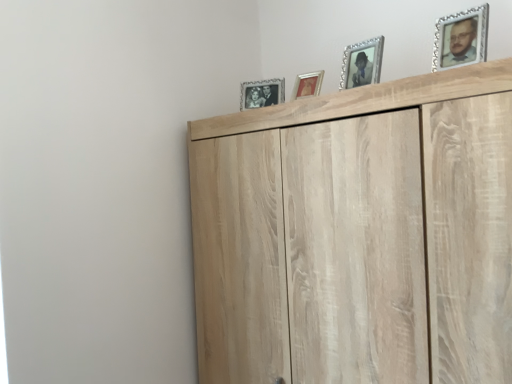
Question: Would you say gold-framed picture at upper center, which ranks as the 3th picture frame in front-to-back order, contains light wood cupboard at upper center?

Choices:
 (A) no
 (B) yes

Answer: (A)

Question: Does gold-framed picture at upper center, placed as the 3th picture frame when sorted from right to left, have a greater width compared to light wood cupboard at upper center?

Choices:
 (A) yes
 (B) no

Answer: (B)

Question: From the image's perspective, does gold-framed picture at upper center, acting as the 2th picture frame starting from the back, appear higher than light wood cupboard at upper center?

Choices:
 (A) no
 (B) yes

Answer: (B)

Question: Can you confirm if gold-framed picture at upper center, placed as the 3th picture frame when sorted from right to left, is bigger than light wood cupboard at upper center?

Choices:
 (A) no
 (B) yes

Answer: (A)

Question: From a real-world perspective, is gold-framed picture at upper center, placed as the 3th picture frame when sorted from right to left, located beneath light wood cupboard at upper center?

Choices:
 (A) no
 (B) yes

Answer: (A)

Question: Is light wood cupboard at upper center at the back of gold-framed picture at upper center, the 2th picture frame positioned from the left?

Choices:
 (A) no
 (B) yes

Answer: (A)

Question: From a real-world perspective, does silver/glass photo frame at upper center, which is the fourth picture frame in front-to-back order, stand above light wood cupboard at upper center?

Choices:
 (A) yes
 (B) no

Answer: (A)

Question: Would you say silver/glass photo frame at upper center, which is the fourth picture frame in front-to-back order, is outside light wood cupboard at upper center?

Choices:
 (A) yes
 (B) no

Answer: (A)

Question: From the image's perspective, would you say silver/glass photo frame at upper center, placed as the 1th picture frame when sorted from back to front, is positioned over light wood cupboard at upper center?

Choices:
 (A) no
 (B) yes

Answer: (B)

Question: Is silver/glass photo frame at upper center, which appears as the first picture frame when viewed from the left, oriented towards light wood cupboard at upper center?

Choices:
 (A) no
 (B) yes

Answer: (A)

Question: From a real-world perspective, is silver/glass photo frame at upper center, which appears as the fourth picture frame when viewed from the right, physically below light wood cupboard at upper center?

Choices:
 (A) yes
 (B) no

Answer: (B)

Question: Can you confirm if silver/glass photo frame at upper center, which appears as the first picture frame when viewed from the left, is taller than light wood cupboard at upper center?

Choices:
 (A) yes
 (B) no

Answer: (B)

Question: Is gold-framed picture at upper center, placed as the 3th picture frame when sorted from right to left, shorter than silver/glass photo frame at upper center, placed as the 1th picture frame when sorted from back to front?

Choices:
 (A) yes
 (B) no

Answer: (A)